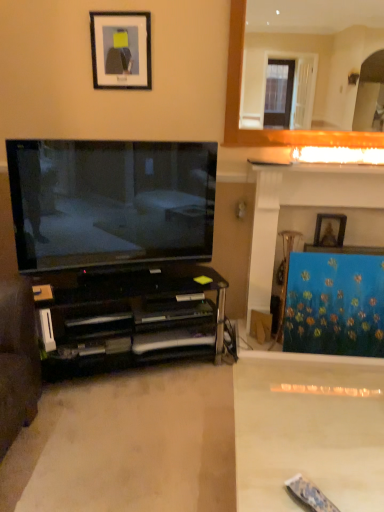
This screenshot has width=384, height=512. Identify the location of free space above white glossy plain at lower right (from a real-world perspective). (326, 423).